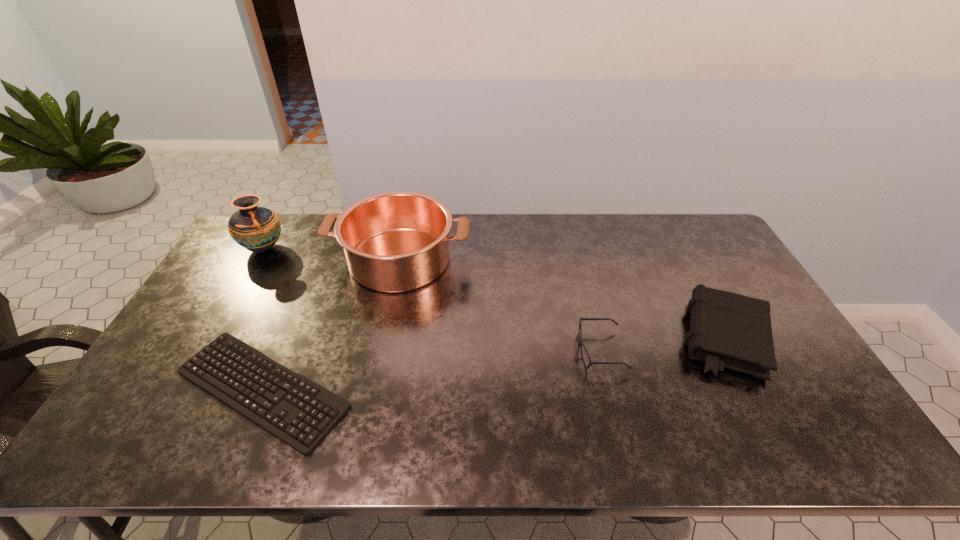
At what (x,y) coordinates should I click in order to perform the action: click on object that is at the far left corner. Please return your answer as a coordinate pair (x, y). This screenshot has width=960, height=540. Looking at the image, I should click on (257, 229).

In order to click on object that is positioned at the near left corner in this screenshot , I will do `click(325, 401)`.

I want to click on free space at the far edge of the desktop, so pyautogui.click(x=306, y=220).

The height and width of the screenshot is (540, 960). In the image, there is a desktop. Find the location of `blank space at the near edge`. blank space at the near edge is located at coordinates (728, 442).

Identify the location of vacant region at the left edge of the desktop. point(174,387).

Locate an element on the screen. This screenshot has width=960, height=540. vacant position at the right edge of the desktop is located at coordinates (730, 266).

Locate an element on the screen. The image size is (960, 540). free space at the far right corner is located at coordinates (708, 237).

The width and height of the screenshot is (960, 540). In order to click on vacant region between the tallest object and the fourth shortest object in this screenshot , I will do `click(332, 254)`.

What are the coordinates of `free space that is in between the fourth shortest object and the pottery` in the screenshot? It's located at (332, 254).

Locate an element on the screen. This screenshot has height=540, width=960. free space between the rightmost object and the tallest object is located at coordinates (494, 293).